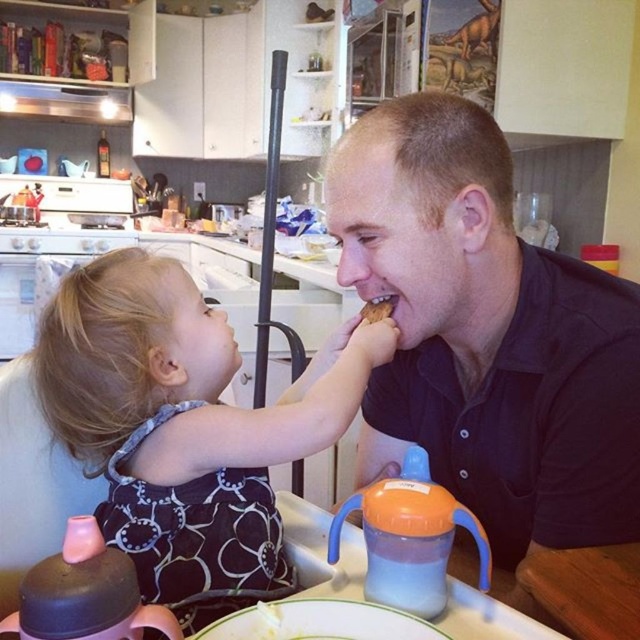
Question: Does black matte shirt at center appear on the left side of matte black dress at center?

Choices:
 (A) no
 (B) yes

Answer: (A)

Question: Which is nearer to the brown crumbly bread at mouth?

Choices:
 (A) black matte shirt at center
 (B) matte black dress at center

Answer: (A)

Question: Which object is farther from the camera taking this photo?

Choices:
 (A) matte black dress at center
 (B) black matte shirt at center

Answer: (B)

Question: Does matte black dress at center appear on the left side of brown crumbly bread at mouth?

Choices:
 (A) no
 (B) yes

Answer: (B)

Question: In this image, where is black matte shirt at center located relative to matte black dress at center?

Choices:
 (A) left
 (B) right

Answer: (B)

Question: Which point appears farthest from the camera in this image?

Choices:
 (A) (384, 308)
 (B) (99, 298)

Answer: (A)